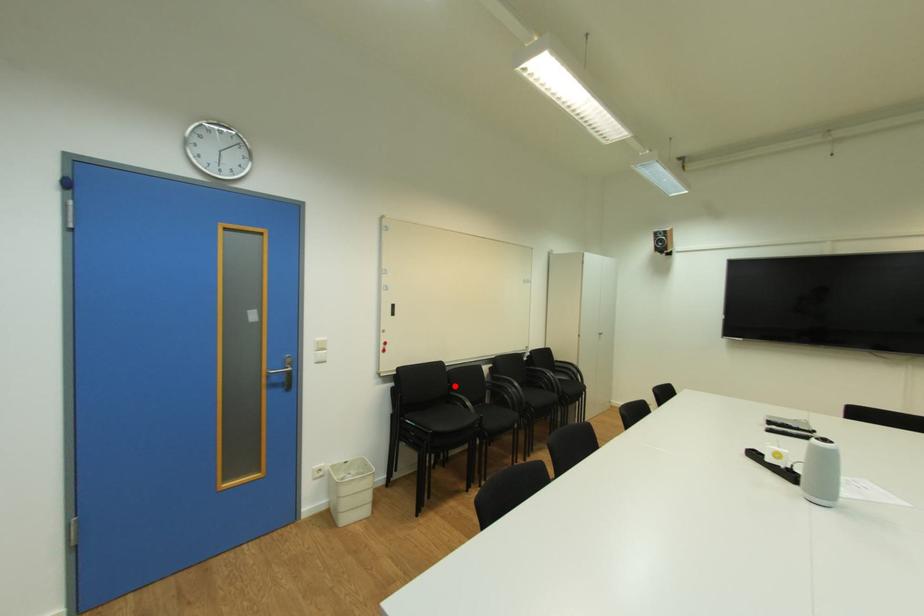
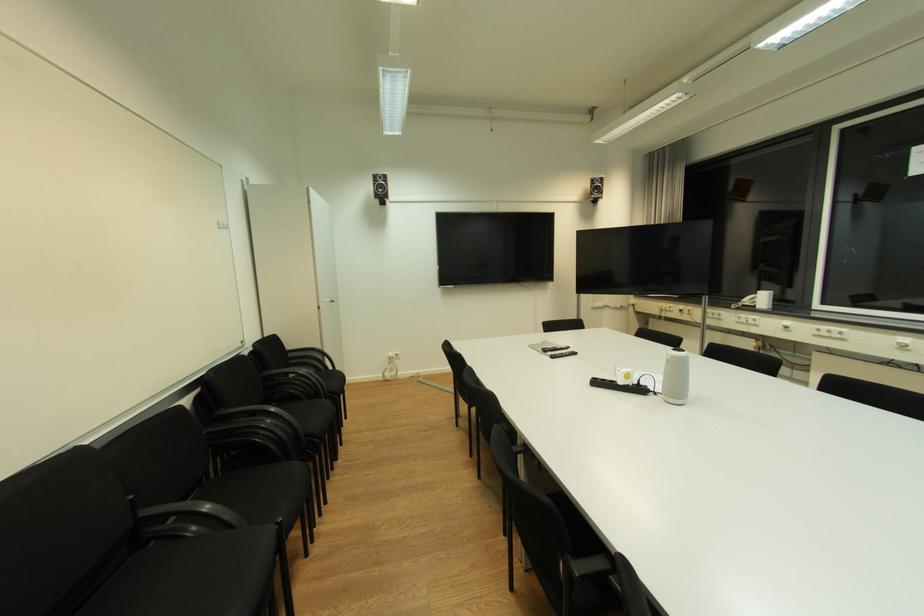
Question: I am providing you with two images of the same scene from different viewpoints. Given a red point in image1, look at the same physical point in image2. Is it:

Choices:
 (A) Closer to the viewpoint
 (B) Farther from the viewpoint

Answer: (A)